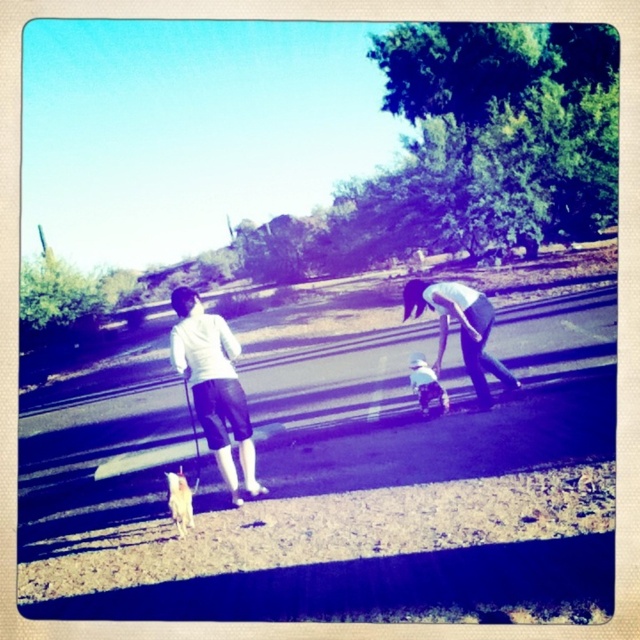
Who is more forward, (518, 387) or (168, 492)?

Positioned in front is point (168, 492).

Consider the image. Between light blue denim jeans at center and white fur dog at lower left, which one has more height?

With more height is light blue denim jeans at center.

You are a GUI agent. You are given a task and a screenshot of the screen. Output one action in this format:
    pyautogui.click(x=<x>, y=<y>)
    Task: Click on the light blue denim jeans at center
    Image resolution: width=640 pixels, height=640 pixels.
    Given the screenshot: What is the action you would take?
    pyautogui.click(x=460, y=330)

I want to click on light blue denim jeans at center, so click(x=460, y=330).

Is light blue denim jeans at center positioned behind white cotton shirt at lower center?

No, light blue denim jeans at center is closer to the viewer.

What do you see at coordinates (460, 330) in the screenshot?
I see `light blue denim jeans at center` at bounding box center [460, 330].

Is point (492, 317) positioned before point (444, 396)?

Yes, point (492, 317) is in front of point (444, 396).

Identify the location of light blue denim jeans at center. This screenshot has height=640, width=640. (460, 330).

Can you confirm if white cotton shirt at lower center is bigger than white fur dog at lower left?

Indeed, white cotton shirt at lower center has a larger size compared to white fur dog at lower left.

Can you confirm if white cotton shirt at lower center is taller than white fur dog at lower left?

Correct, white cotton shirt at lower center is much taller as white fur dog at lower left.

You are a GUI agent. You are given a task and a screenshot of the screen. Output one action in this format:
    pyautogui.click(x=<x>, y=<y>)
    Task: Click on the white cotton shirt at lower center
    The width and height of the screenshot is (640, 640).
    Given the screenshot: What is the action you would take?
    pyautogui.click(x=426, y=385)